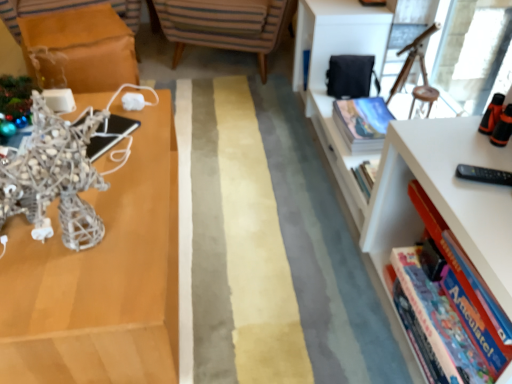
Question: From the image's perspective, is white plastic bookcase at right positioned above or below hardcover book at right, arranged as the 2th book when viewed from the back?

Choices:
 (A) below
 (B) above

Answer: (B)

Question: In the image, is white plastic bookcase at right positioned in front of or behind hardcover book at right, which is the first book from front to back?

Choices:
 (A) behind
 (B) front

Answer: (B)

Question: Based on their relative distances, which object is farther from the hardcover book at right, the second book from the top?

Choices:
 (A) matte brown table at left
 (B) matte silver sculpture at left
 (C) hardcover book at upper right, marked as the 1th book in a top-to-bottom arrangement
 (D) white plastic bookcase at right
 (E) striped fabric chair at center

Answer: (A)

Question: Which object is the closest to the striped fabric chair at center?

Choices:
 (A) matte brown table at left
 (B) hardcover book at upper right, the 1th book viewed from the back
 (C) hardcover book at right, arranged as the 2th book when viewed from the back
 (D) white plastic bookcase at right
 (E) matte silver sculpture at left

Answer: (A)